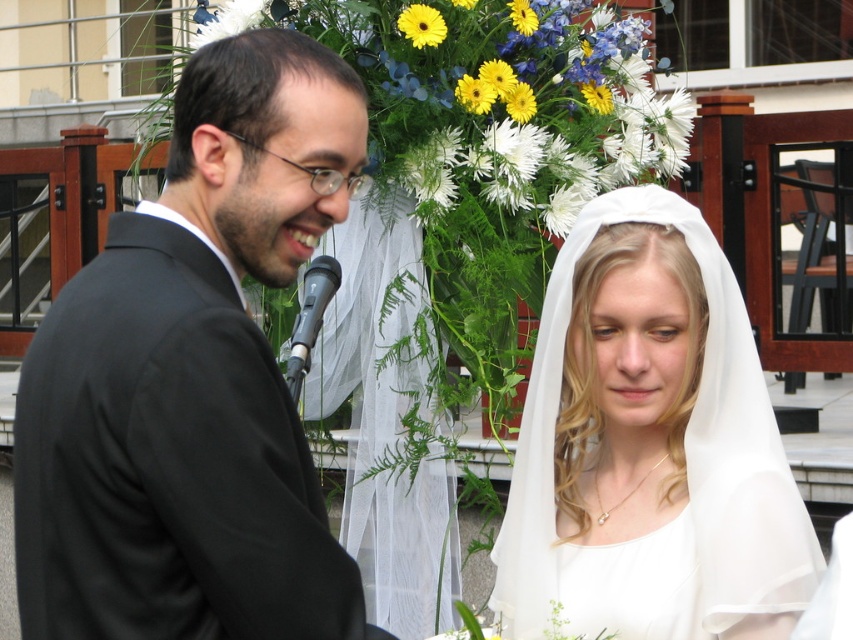
Consider the image. In the wedding scene, you notice the black matte suit at left and the white sheer veil at center. Which object is taller?

The black matte suit at left is taller than the white sheer veil at center.

In the wedding scene, there is a point labeled as point (648, 445). What object is located at that specific coordinate?

The white sheer veil at center is located at point (648, 445).